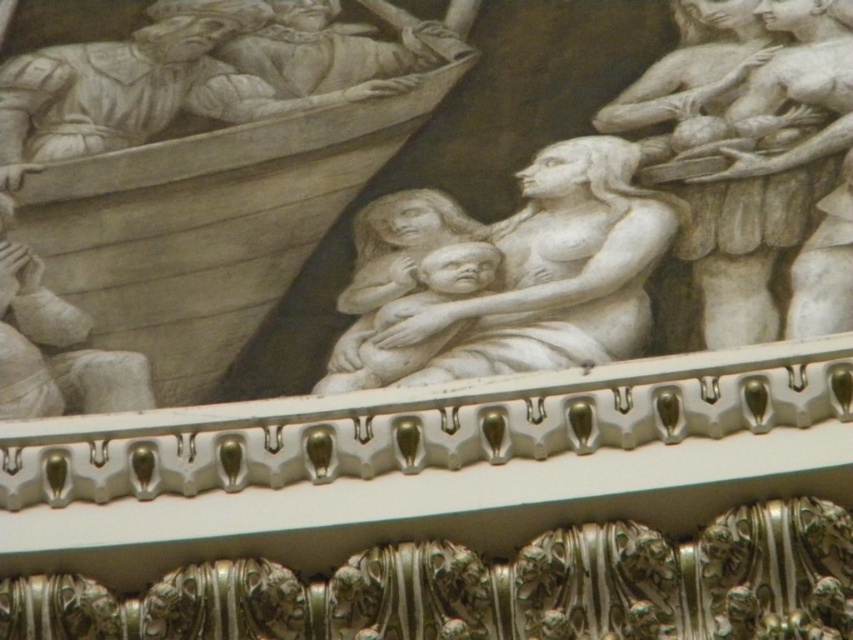
Based on the photo, who is more forward, (657,544) or (607,243)?

Point (657,544) is more forward.

Between polished bronze relief at center and white marble sculpture at center, which one appears on the right side from the viewer's perspective?

white marble sculpture at center is more to the right.

Who is more distant from viewer, (672, 634) or (421, 342)?

The point (421, 342) is behind.

In order to click on polished bronze relief at center in this screenshot , I will do `click(492, 588)`.

Between wooden boat at center and white marble boat at upper left, which one is positioned lower?

wooden boat at center

Does wooden boat at center come in front of white marble boat at upper left?

Yes, it is in front of white marble boat at upper left.

Based on the photo, who is more forward, (192, 80) or (57, 125)?

Point (57, 125)

Identify the location of wooden boat at center. The image size is (853, 640). (194, 179).

Is wooden boat at center to the right of white marble woman holding child at upper right from the viewer's perspective?

No, wooden boat at center is not to the right of white marble woman holding child at upper right.

Measure the distance between wooden boat at center and white marble woman holding child at upper right.

wooden boat at center is 29.70 feet away from white marble woman holding child at upper right.

Is point (346, 116) positioned after point (820, 248)?

Yes, it is behind point (820, 248).

Where is `wooden boat at center`? This screenshot has height=640, width=853. wooden boat at center is located at coordinates (194, 179).